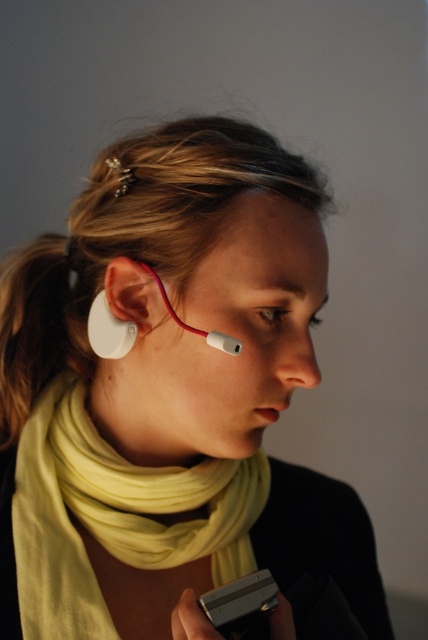
Who is positioned more to the right, yellow soft scarf at lower center or silver metallic smartphone at lower center?

silver metallic smartphone at lower center is more to the right.

Can you confirm if yellow soft scarf at lower center is positioned to the left of silver metallic smartphone at lower center?

Correct, you'll find yellow soft scarf at lower center to the left of silver metallic smartphone at lower center.

Does point (166, 493) come farther from viewer compared to point (261, 593)?

That is True.

Locate an element on the screen. The width and height of the screenshot is (428, 640). yellow soft scarf at lower center is located at coordinates (115, 515).

Who is lower down, matte white earbud at left or white matte earbud at lower left?

Positioned lower is white matte earbud at lower left.

The width and height of the screenshot is (428, 640). What do you see at coordinates (130, 292) in the screenshot?
I see `matte white earbud at left` at bounding box center [130, 292].

This screenshot has height=640, width=428. I want to click on matte white earbud at left, so click(x=130, y=292).

Does point (17, 276) come behind point (237, 596)?

That is True.

What do you see at coordinates (30, 324) in the screenshot? This screenshot has height=640, width=428. I see `white matte earbud at left` at bounding box center [30, 324].

Find the location of a particular element. The image size is (428, 640). white matte earbud at left is located at coordinates (30, 324).

Locate an element on the screen. Image resolution: width=428 pixels, height=640 pixels. white matte earbud at left is located at coordinates (30, 324).